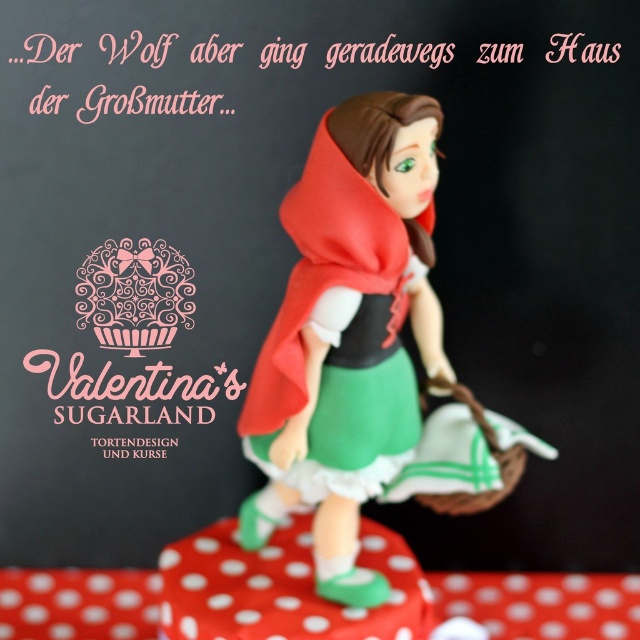
Question: Does matte red cape at center appear on the right side of red polka dot fabric at lower center?

Choices:
 (A) yes
 (B) no

Answer: (B)

Question: Among these points, which one is nearest to the camera?

Choices:
 (A) (134, 595)
 (B) (74, 285)
 (C) (396, 196)

Answer: (C)

Question: Considering the real-world distances, which object is closest to the red polka dot fabric at lower center?

Choices:
 (A) pink sugar cupcake at center
 (B) matte red cape at center

Answer: (B)

Question: Among these points, which one is nearest to the camera?

Choices:
 (A) (116, 342)
 (B) (540, 592)
 (C) (305, 339)

Answer: (C)

Question: Is red polka dot fabric at lower center wider than pink sugar cupcake at center?

Choices:
 (A) no
 (B) yes

Answer: (B)

Question: Does matte red cape at center appear on the right side of red polka dot fabric at lower center?

Choices:
 (A) no
 (B) yes

Answer: (A)